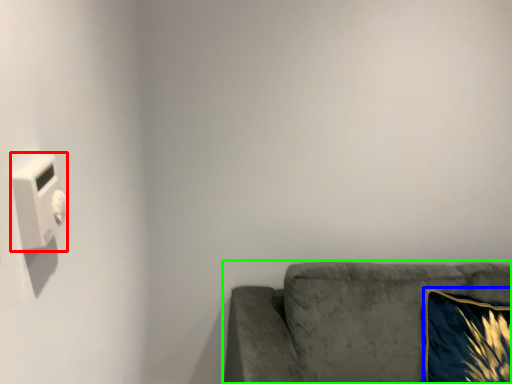
Question: Which is farther away from light switch (highlighted by a red box)? throw pillow (highlighted by a blue box) or studio couch (highlighted by a green box)?

Choices:
 (A) throw pillow
 (B) studio couch

Answer: (A)